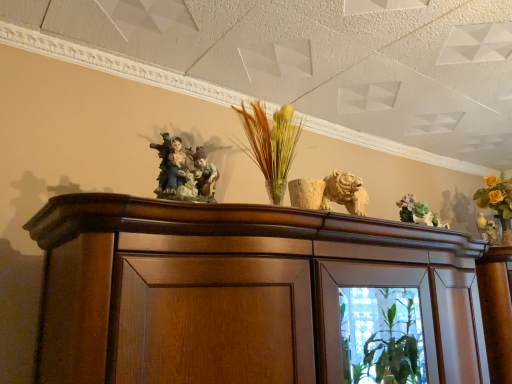
Question: Is matte porcelain figurine at center inside the boundaries of green ceramic vase at upper right, or outside?

Choices:
 (A) outside
 (B) inside

Answer: (A)

Question: Based on their sizes in the image, would you say matte porcelain figurine at center is bigger or smaller than green ceramic vase at upper right?

Choices:
 (A) small
 (B) big

Answer: (B)

Question: Does point (194, 180) appear closer or farther from the camera than point (406, 205)?

Choices:
 (A) closer
 (B) farther

Answer: (A)

Question: Do you think green ceramic vase at upper right is within matte porcelain figurine at center, or outside of it?

Choices:
 (A) outside
 (B) inside

Answer: (A)

Question: From their relative heights in the image, would you say green ceramic vase at upper right is taller or shorter than matte porcelain figurine at center?

Choices:
 (A) short
 (B) tall

Answer: (A)

Question: From the image's perspective, is green ceramic vase at upper right positioned above or below matte porcelain figurine at center?

Choices:
 (A) below
 (B) above

Answer: (A)

Question: Visually, is green ceramic vase at upper right positioned to the left or to the right of matte porcelain figurine at center?

Choices:
 (A) left
 (B) right

Answer: (B)